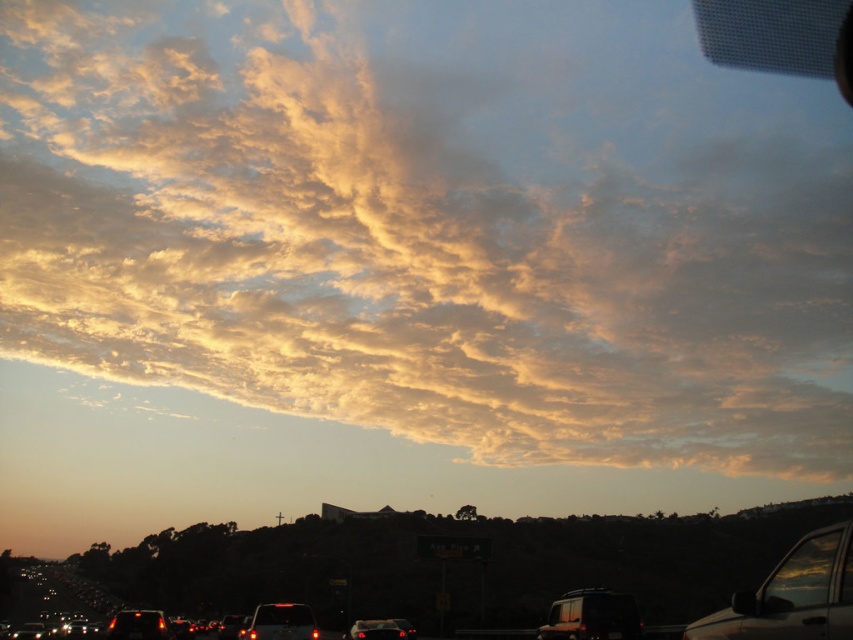
Does metallic silver car at lower right appear over matte black car at center?

Yes, metallic silver car at lower right is above matte black car at center.

Is point (790, 614) positioned behind point (405, 636)?

No, (790, 614) is closer to viewer.

You are a GUI agent. You are given a task and a screenshot of the screen. Output one action in this format:
    pyautogui.click(x=<x>, y=<y>)
    Task: Click on the metallic silver car at lower right
    
    Given the screenshot: What is the action you would take?
    click(x=793, y=595)

Is point (605, 621) more distant than point (364, 637)?

No, (605, 621) is in front of (364, 637).

Is metallic silver van at lower right bigger than matte black car at center?

Yes.

Does point (589, 593) lie in front of point (357, 624)?

That is True.

Locate an element on the screen. Image resolution: width=853 pixels, height=640 pixels. metallic silver van at lower right is located at coordinates (590, 616).

Is metallic silver car at lower right to the left of matte black car at lower center from the viewer's perspective?

In fact, metallic silver car at lower right is to the right of matte black car at lower center.

How distant is metallic silver car at lower right from matte black car at lower center?

metallic silver car at lower right and matte black car at lower center are 13.43 meters apart.

This screenshot has width=853, height=640. Identify the location of metallic silver car at lower right. (793, 595).